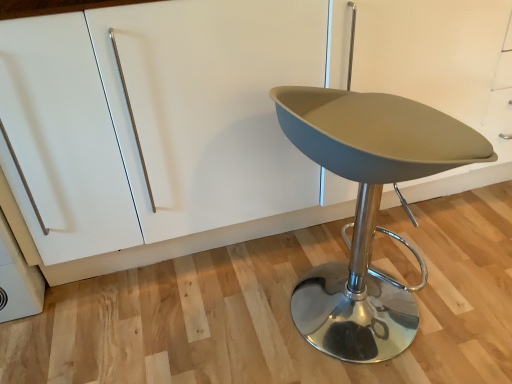
Find the location of a particular element. This screenshot has height=384, width=512. free space to the back side of matte gray stool at center is located at coordinates (336, 244).